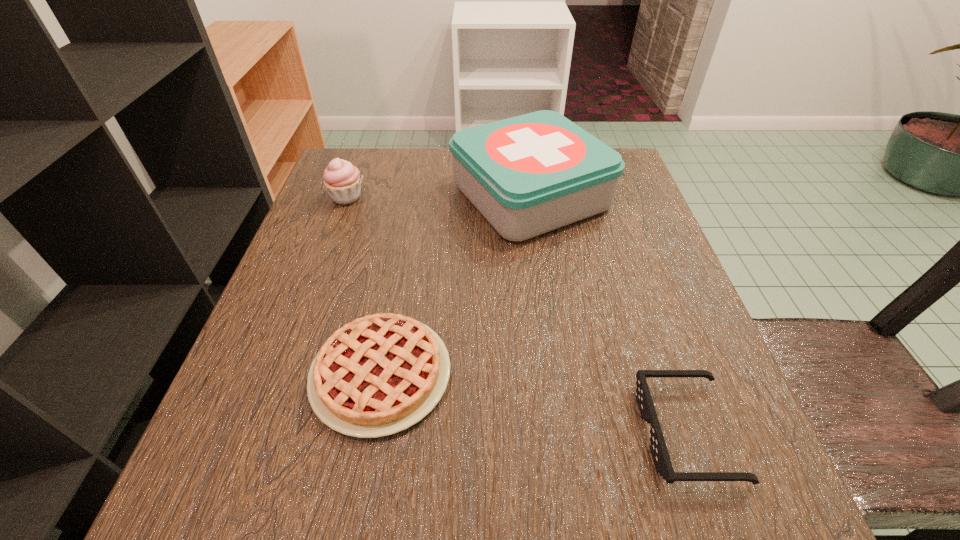
Where is `vacant region located on the front-facing side of the sunglasses`? Image resolution: width=960 pixels, height=540 pixels. vacant region located on the front-facing side of the sunglasses is located at coordinates (564, 433).

Find the location of `the first-aid kit that is at the far edge`. the first-aid kit that is at the far edge is located at coordinates (527, 175).

The height and width of the screenshot is (540, 960). Find the location of `cupcake situated at the far edge`. cupcake situated at the far edge is located at coordinates (342, 180).

At what (x,y) coordinates should I click in order to perform the action: click on object present at the near edge. Please return your answer as a coordinate pair (x, y). Image resolution: width=960 pixels, height=540 pixels. Looking at the image, I should click on (659, 451).

At what (x,y) coordinates should I click in order to perform the action: click on cupcake that is at the left edge. Please return your answer as a coordinate pair (x, y). The image size is (960, 540). Looking at the image, I should click on (342, 180).

At what (x,y) coordinates should I click in order to perform the action: click on pie located at the left edge. Please return your answer as a coordinate pair (x, y). Looking at the image, I should click on (378, 375).

Where is `the first-aid kit positioned at the right edge`? Image resolution: width=960 pixels, height=540 pixels. the first-aid kit positioned at the right edge is located at coordinates (527, 175).

At what (x,y) coordinates should I click in order to perform the action: click on sunglasses present at the right edge. Please return your answer as a coordinate pair (x, y). Looking at the image, I should click on (659, 451).

The height and width of the screenshot is (540, 960). In order to click on object present at the far left corner in this screenshot , I will do `click(342, 180)`.

Identify the location of object positioned at the far right corner. The image size is (960, 540). (527, 175).